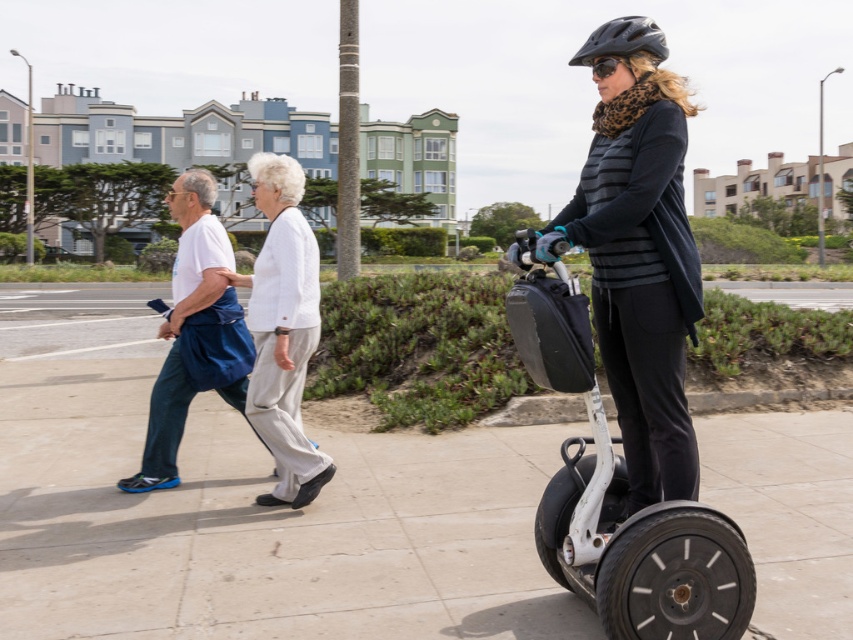
Question: Which object appears closest to the camera in this image?

Choices:
 (A) white matte segway at center
 (B) white cotton pants at center
 (C) matte black segway at center

Answer: (A)

Question: Does matte black segway at center appear over white matte segway at center?

Choices:
 (A) yes
 (B) no

Answer: (A)

Question: Estimate the real-world distances between objects in this image. Which object is closer to the white cotton shirt at left?

Choices:
 (A) white cotton pants at center
 (B) white matte segway at center

Answer: (A)

Question: Which is nearer to the white cotton pants at center?

Choices:
 (A) white matte segway at center
 (B) light gray concrete sidewalk at center

Answer: (A)

Question: Can you confirm if matte black segway at center is wider than white matte segway at center?

Choices:
 (A) yes
 (B) no

Answer: (B)

Question: Is light gray concrete sidewalk at center positioned at the back of matte black segway at center?

Choices:
 (A) no
 (B) yes

Answer: (B)